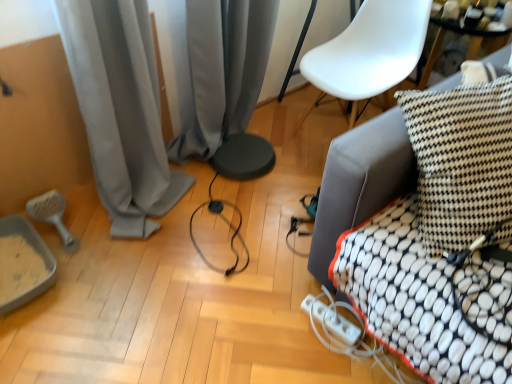
Identify the location of blank area beneath white plastic armchair at upper right (from a real-world perspective). (328, 133).